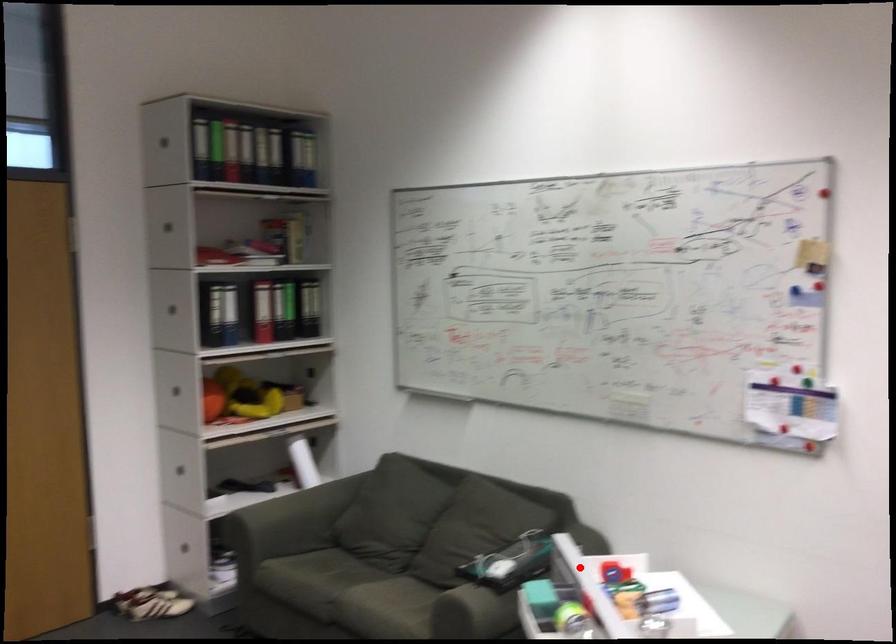
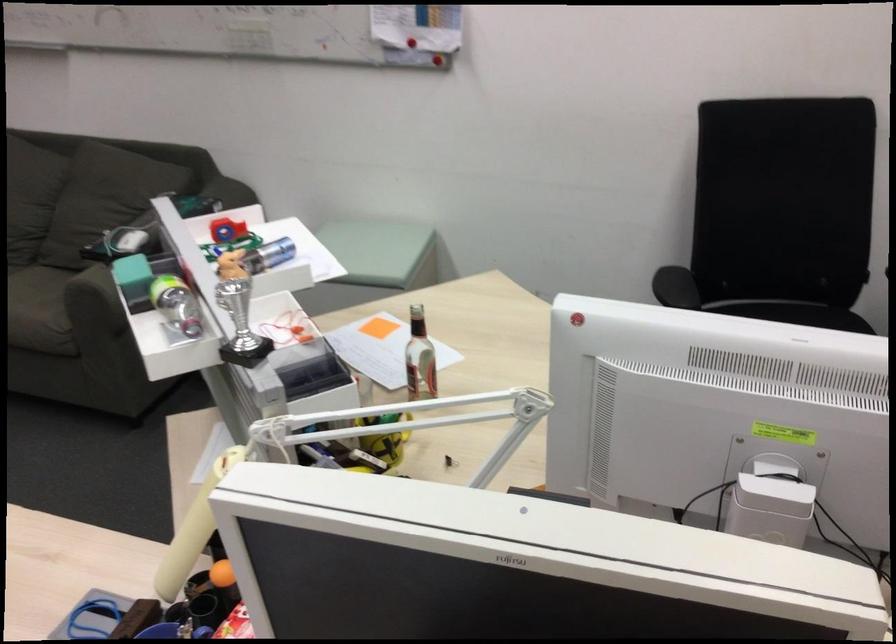
The point at the highlighted location is marked in the first image. Where is the corresponding point in the second image?

(221, 230)